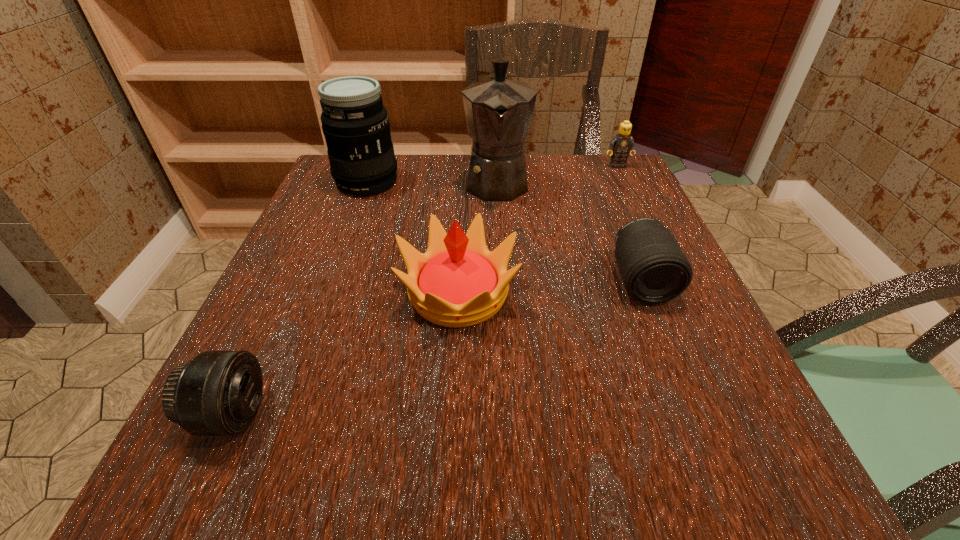
What are the coordinates of `free space located in front of the Lego` in the screenshot? It's located at (668, 272).

Find the location of a particular element. vacant space located on the surface of the rightmost telephoto lens is located at coordinates (667, 345).

Find the location of a particular element. vacant region located on the front-facing side of the nearest object is located at coordinates (324, 415).

This screenshot has height=540, width=960. I want to click on coffeepot positioned at the far edge, so click(x=498, y=111).

This screenshot has height=540, width=960. I want to click on telephoto lens present at the far edge, so click(355, 123).

You are a GUI agent. You are given a task and a screenshot of the screen. Output one action in this format:
    pyautogui.click(x=<x>, y=<y>)
    Task: Click on the Lego at the far edge
    
    Given the screenshot: What is the action you would take?
    pyautogui.click(x=620, y=145)

Where is `object that is at the near edge`? Image resolution: width=960 pixels, height=540 pixels. object that is at the near edge is located at coordinates (216, 393).

Locate an element on the screen. Lego that is at the right edge is located at coordinates (620, 145).

Find the location of `telephoto lens at the right edge`. telephoto lens at the right edge is located at coordinates (654, 269).

In order to click on object present at the far left corner in this screenshot , I will do `click(355, 123)`.